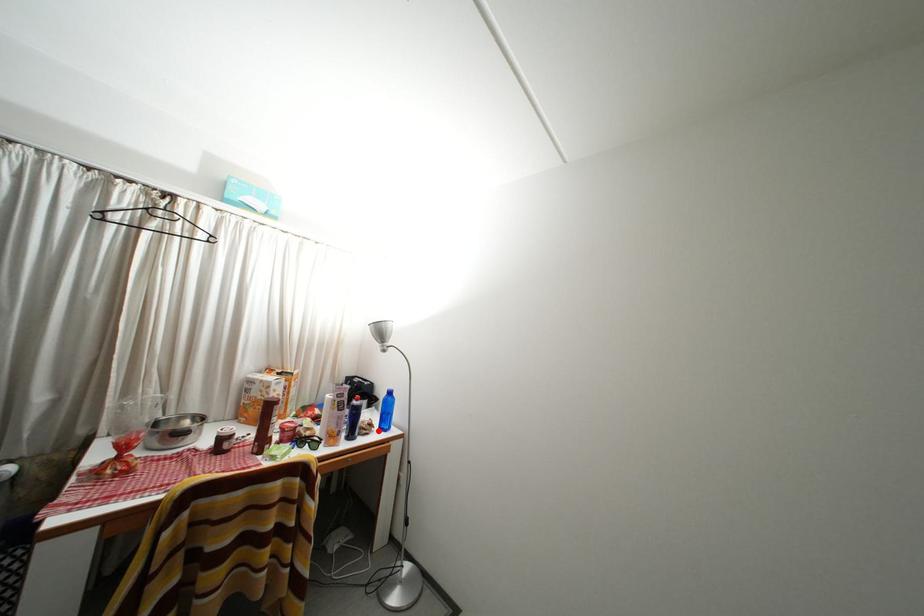
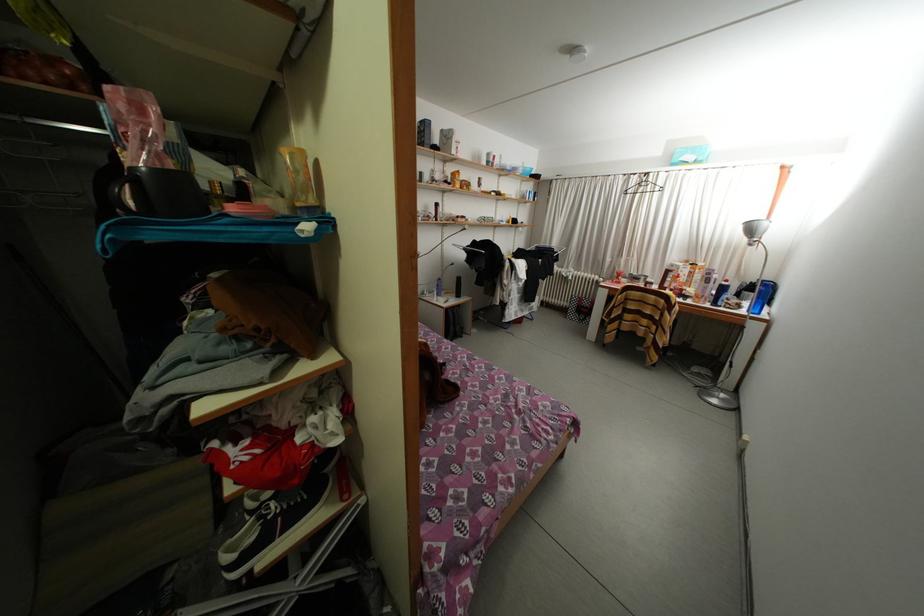
Find the pixel in the second image that matches the highlighted location in the first image.

(747, 310)